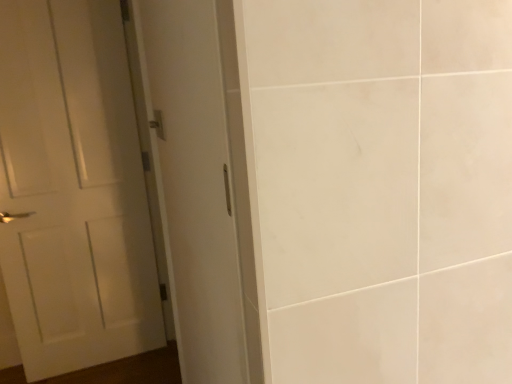
Question: From the image's perspective, does white matte door at left appear lower than metallic silver door handle at upper left?

Choices:
 (A) no
 (B) yes

Answer: (B)

Question: From a real-world perspective, is white matte door at left on top of metallic silver door handle at upper left?

Choices:
 (A) no
 (B) yes

Answer: (A)

Question: Considering the relative positions of white matte door at left and metallic silver door handle at upper left in the image provided, is white matte door at left to the right of metallic silver door handle at upper left from the viewer's perspective?

Choices:
 (A) no
 (B) yes

Answer: (A)

Question: Considering the relative sizes of white matte door at left and metallic silver door handle at upper left in the image provided, is white matte door at left taller than metallic silver door handle at upper left?

Choices:
 (A) yes
 (B) no

Answer: (A)

Question: Does white matte door at left have a lesser width compared to metallic silver door handle at upper left?

Choices:
 (A) yes
 (B) no

Answer: (B)

Question: Is white matte door at left aimed at metallic silver door handle at upper left?

Choices:
 (A) no
 (B) yes

Answer: (B)

Question: Is white glossy door at left taller than white matte door at left?

Choices:
 (A) no
 (B) yes

Answer: (B)

Question: Can you confirm if white glossy door at left is bigger than white matte door at left?

Choices:
 (A) yes
 (B) no

Answer: (A)

Question: Can you confirm if white glossy door at left is positioned to the right of white matte door at left?

Choices:
 (A) no
 (B) yes

Answer: (B)

Question: Is white glossy door at left oriented towards white matte door at left?

Choices:
 (A) no
 (B) yes

Answer: (B)

Question: Does white glossy door at left have a lesser height compared to white matte door at left?

Choices:
 (A) no
 (B) yes

Answer: (A)

Question: Can white matte door at left be found inside white glossy door at left?

Choices:
 (A) no
 (B) yes

Answer: (A)

Question: Is metallic silver door handle at upper left bigger than white matte door at left?

Choices:
 (A) yes
 (B) no

Answer: (B)